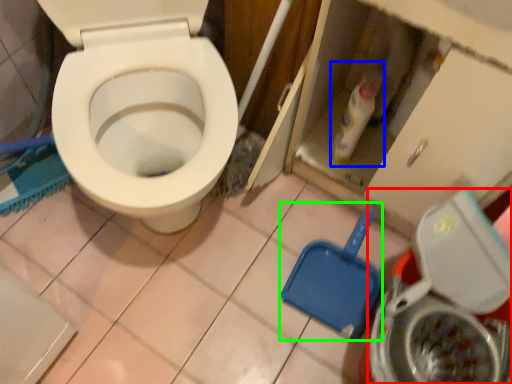
Question: Which object is the farthest from washing machine (highlighted by a red box)? Choose among these: cleaning product (highlighted by a blue box) or shovel (highlighted by a green box).

Choices:
 (A) cleaning product
 (B) shovel

Answer: (A)